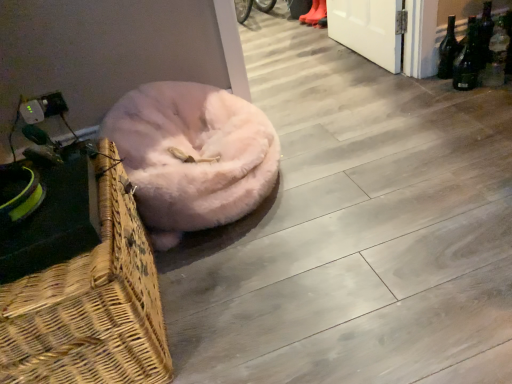
At what (x,y) coordinates should I click in order to perform the action: click on vacant area that lies to the right of fuzzy pink dog bed at lower left. Please return your answer as a coordinate pair (x, y). Image resolution: width=512 pixels, height=384 pixels. Looking at the image, I should click on (379, 179).